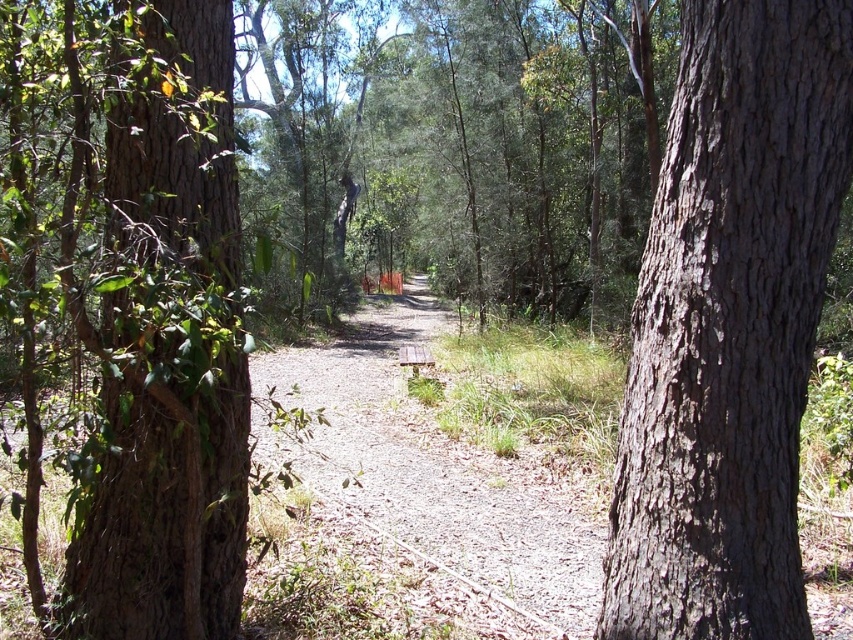
You are a hiker walking along the forest path and want to sit down to rest. You see the brown rough bark tree at left and the wooden bench at center. Which object is closer to your current position if you are standing on the path?

The brown rough bark tree at left is closer to your current position because it is to the left of the wooden bench at center, which is further along the path.

You are a hiker carrying a 1.5 meter wide tent. You want to set up camp on the brown gravel path at center. However, there is a wooden bench at center nearby. Can you place your tent on the path without overlapping the bench?

The brown gravel path at center might be wider than wooden bench at center, so it is possible that the path is wide enough to accommodate the tent without overlapping the bench. However, since the exact width is uncertain, you should measure the path width before deciding.